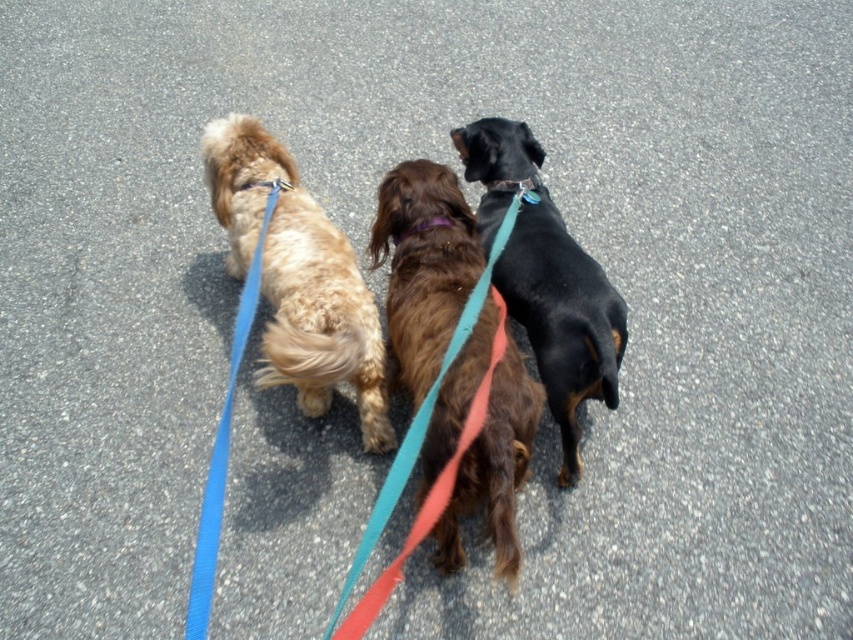
Question: Which object is farther from the camera taking this photo?

Choices:
 (A) teal fabric leash at center
 (B) purple fabric neckband at center
 (C) blue fabric leash at left
 (D) black smooth dog at center

Answer: (B)

Question: Which of these objects is positioned closest to the purple fabric neckband at center?

Choices:
 (A) black smooth dog at center
 (B) light brown fur at left
 (C) teal fabric leash at center
 (D) blue fabric leash at left

Answer: (A)

Question: Does black smooth dog at center have a lesser width compared to teal fabric leash at center?

Choices:
 (A) yes
 (B) no

Answer: (A)

Question: Is light brown fur at left positioned behind purple fabric neckband at center?

Choices:
 (A) no
 (B) yes

Answer: (A)

Question: Can you confirm if light brown fur at left is positioned below teal fabric leash at center?

Choices:
 (A) yes
 (B) no

Answer: (B)

Question: Which point appears farthest from the camera in this image?

Choices:
 (A) (550, 323)
 (B) (289, 356)

Answer: (A)